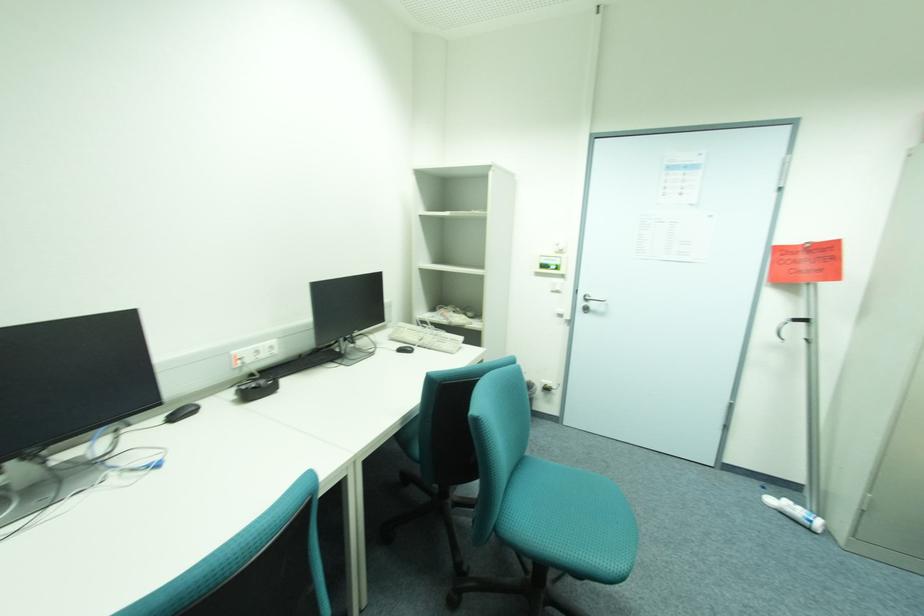
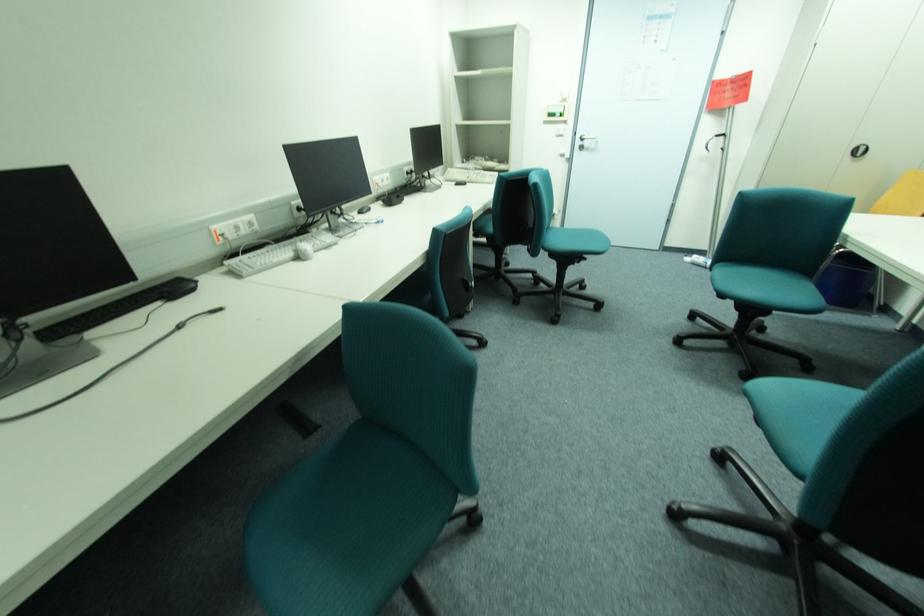
The images are taken continuously from a first-person perspective. In which direction are you moving?

The cameraman moved toward left, backward.